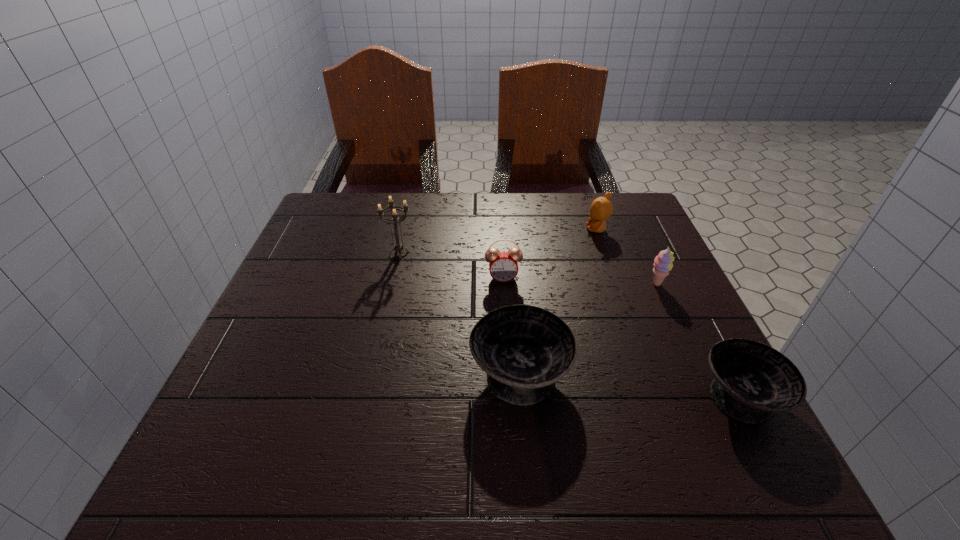
With all bowls evenly spaced, where should an extra bowl be placed on the left to continue the pattern? Please point out a vacant space. Please provide its 2D coordinates. Your answer should be formatted as a tuple, i.e. [(x, y)], where the tuple contains the x and y coordinates of a point satisfying the conditions above.

[(319, 351)]